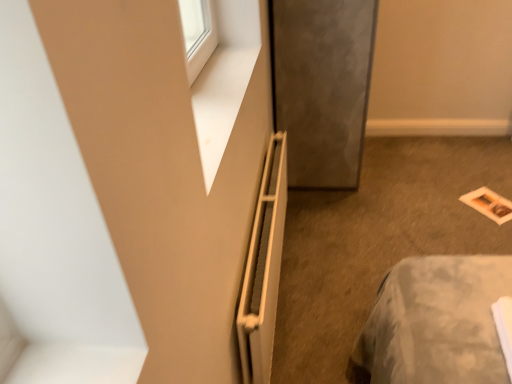
At what (x,y) coordinates should I click in order to perform the action: click on vacant space to the right of matte paper magazine at lower right. Please return your answer as a coordinate pair (x, y). Looking at the image, I should click on (502, 189).